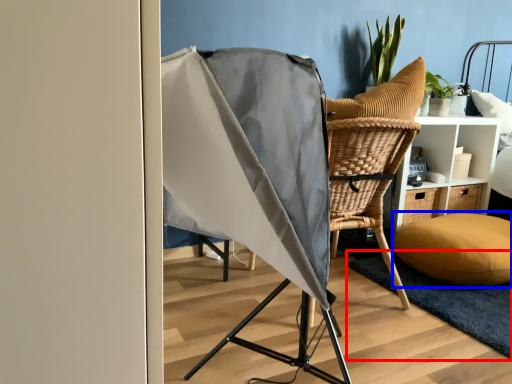
Question: Which object appears farthest to the camera in this image, mat (highlighted by a red box) or pillow (highlighted by a blue box)?

Choices:
 (A) mat
 (B) pillow

Answer: (B)